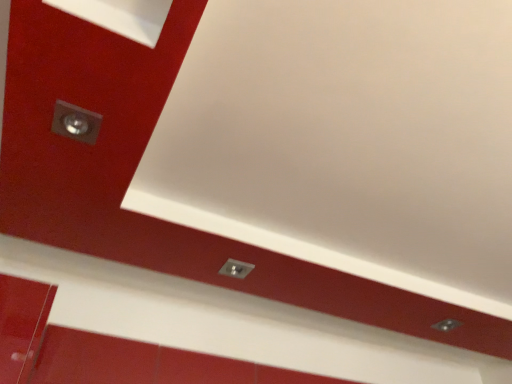
What is the approximate height of metallic silver knob at center?

It is 0.58 inches.

Describe the element at coordinates (236, 268) in the screenshot. This screenshot has width=512, height=384. I see `metallic silver knob at center` at that location.

The image size is (512, 384). Identify the location of metallic silver knob at center. (236, 268).

Identify the location of metallic silver knob at center. (236, 268).